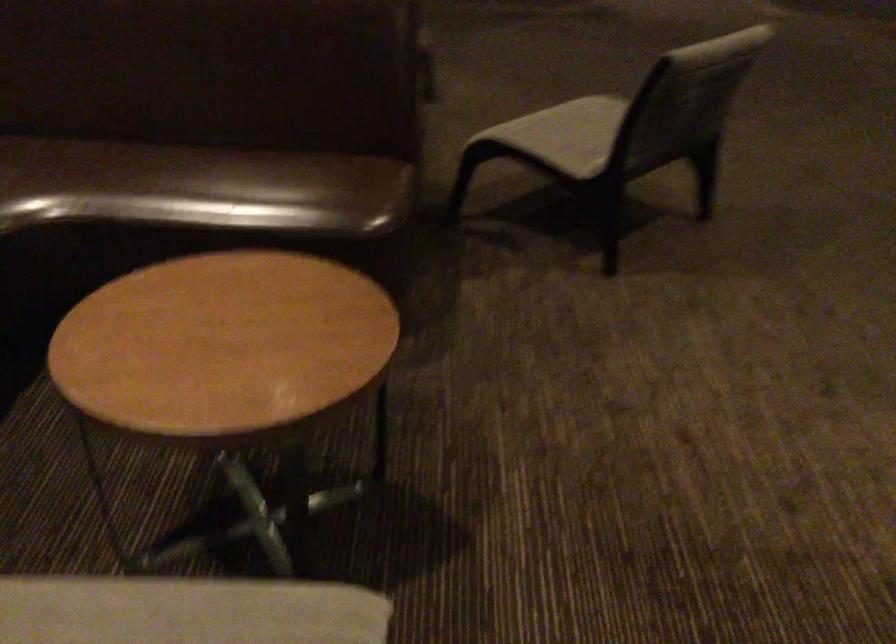
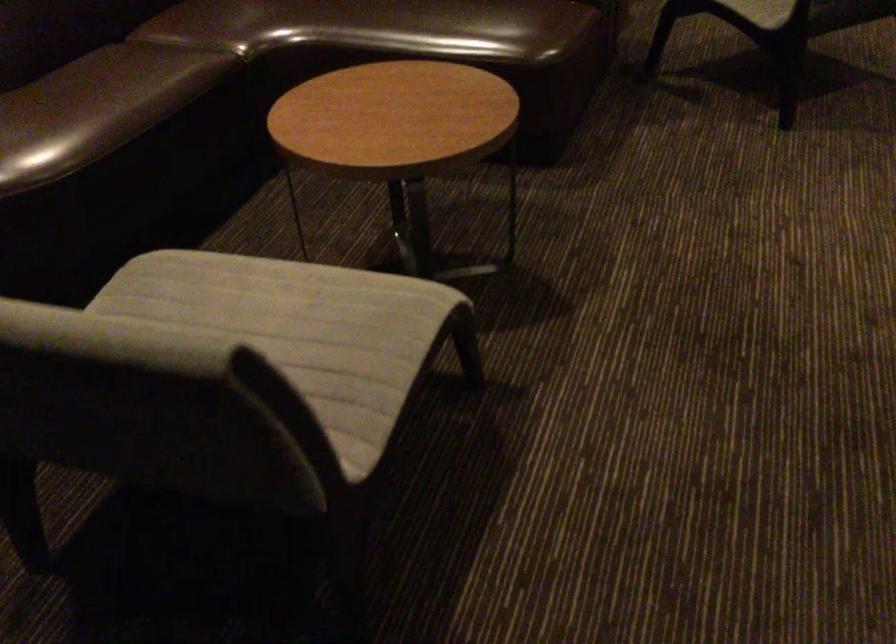
Question: The camera is either moving clockwise (left) or counter-clockwise (right) around the object. The first image is from the beginning of the video and the second image is from the end. Is the camera moving left or right when shooting the video?

Choices:
 (A) Left
 (B) Right

Answer: (B)